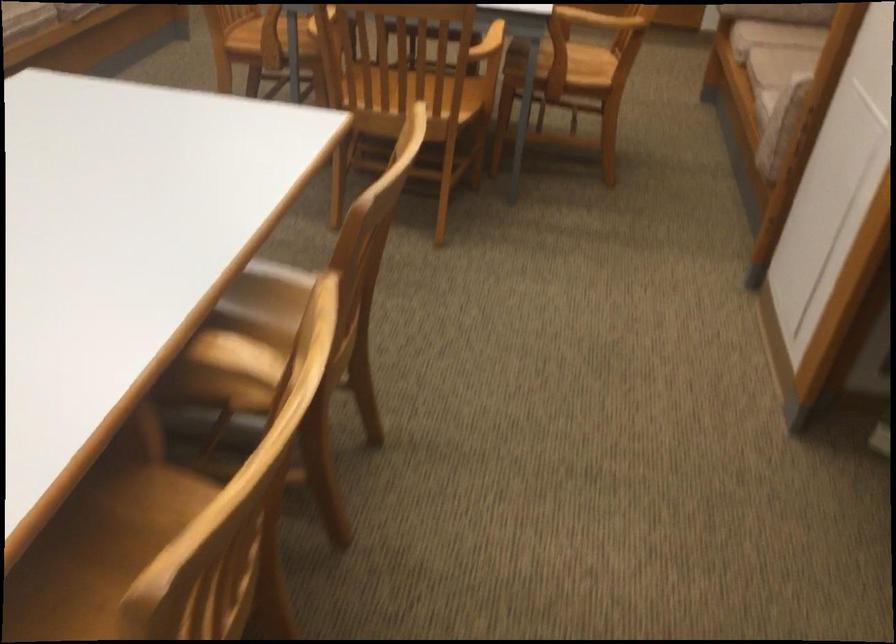
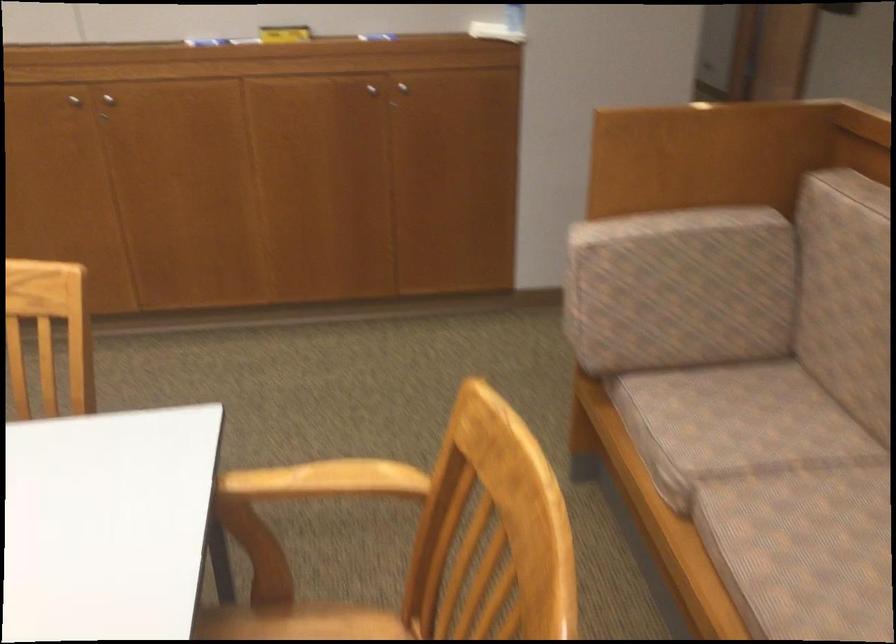
Question: In a continuous first-person perspective shot, in which direction is the camera moving?

Choices:
 (A) Left
 (B) Right
 (C) Forward
 (D) Backward

Answer: (C)